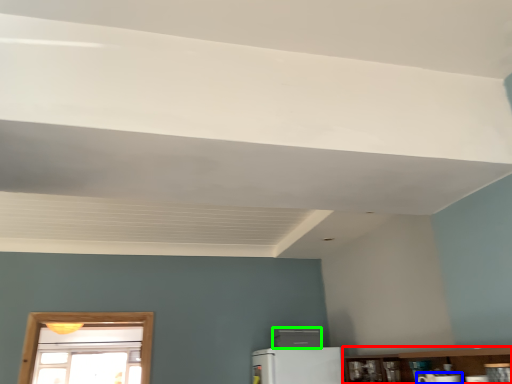
Question: Based on their relative distances, which object is farther from shelf (highlighted by a red box)? Choose from appliance (highlighted by a blue box) and appliance (highlighted by a green box).

Choices:
 (A) appliance
 (B) appliance

Answer: (A)